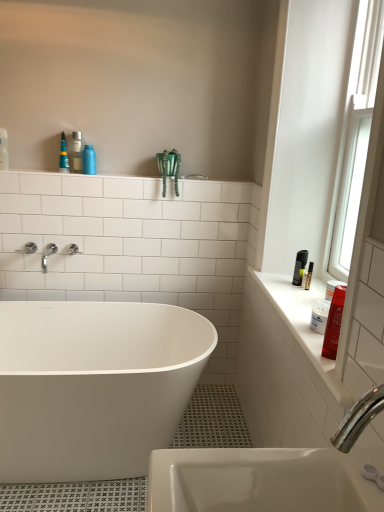
Question: Is shiny red plastic bottle at right, the 1th toiletry from the bottom, closer to the viewer compared to white glossy counter top at right?

Choices:
 (A) no
 (B) yes

Answer: (A)

Question: Is shiny red plastic bottle at right, positioned as the second toiletry in left-to-right order, aimed at white glossy counter top at right?

Choices:
 (A) yes
 (B) no

Answer: (B)

Question: From the image's perspective, is shiny red plastic bottle at right, positioned as the second toiletry in left-to-right order, on top of white glossy counter top at right?

Choices:
 (A) yes
 (B) no

Answer: (A)

Question: Is shiny red plastic bottle at right, which appears as the second toiletry when viewed from the top, next to white glossy counter top at right?

Choices:
 (A) yes
 (B) no

Answer: (B)

Question: Is shiny red plastic bottle at right, which is counted as the first toiletry, starting from the right, shorter than white glossy counter top at right?

Choices:
 (A) yes
 (B) no

Answer: (B)

Question: From a real-world perspective, is shiny red plastic bottle at right, which is counted as the first toiletry, starting from the right, over white glossy counter top at right?

Choices:
 (A) no
 (B) yes

Answer: (B)

Question: Can you confirm if white glass window at right is taller than silver metallic faucet at upper left?

Choices:
 (A) yes
 (B) no

Answer: (A)

Question: Is white glass window at right to the right of silver metallic faucet at upper left from the viewer's perspective?

Choices:
 (A) yes
 (B) no

Answer: (A)

Question: Is white glass window at right turned away from silver metallic faucet at upper left?

Choices:
 (A) yes
 (B) no

Answer: (B)

Question: From the image's perspective, is white glass window at right located above silver metallic faucet at upper left?

Choices:
 (A) yes
 (B) no

Answer: (A)

Question: From a real-world perspective, is white glass window at right positioned over silver metallic faucet at upper left based on gravity?

Choices:
 (A) no
 (B) yes

Answer: (B)

Question: From the image's perspective, is white glass window at right located beneath silver metallic faucet at upper left?

Choices:
 (A) no
 (B) yes

Answer: (A)

Question: Is white glossy counter top at right further to the viewer compared to shiny red plastic bottle at right, positioned as the second toiletry in left-to-right order?

Choices:
 (A) yes
 (B) no

Answer: (B)